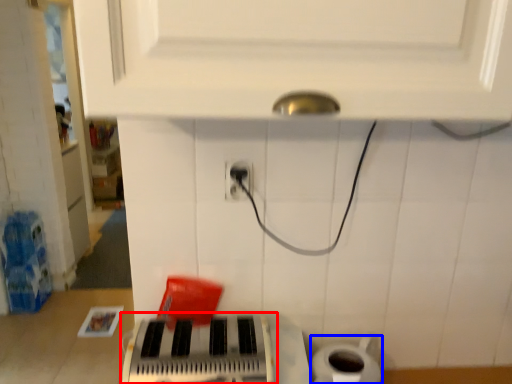
Question: Among these objects, which one is nearest to the camera, musical keyboard (highlighted by a red box) or toilet paper (highlighted by a blue box)?

Choices:
 (A) musical keyboard
 (B) toilet paper

Answer: (A)